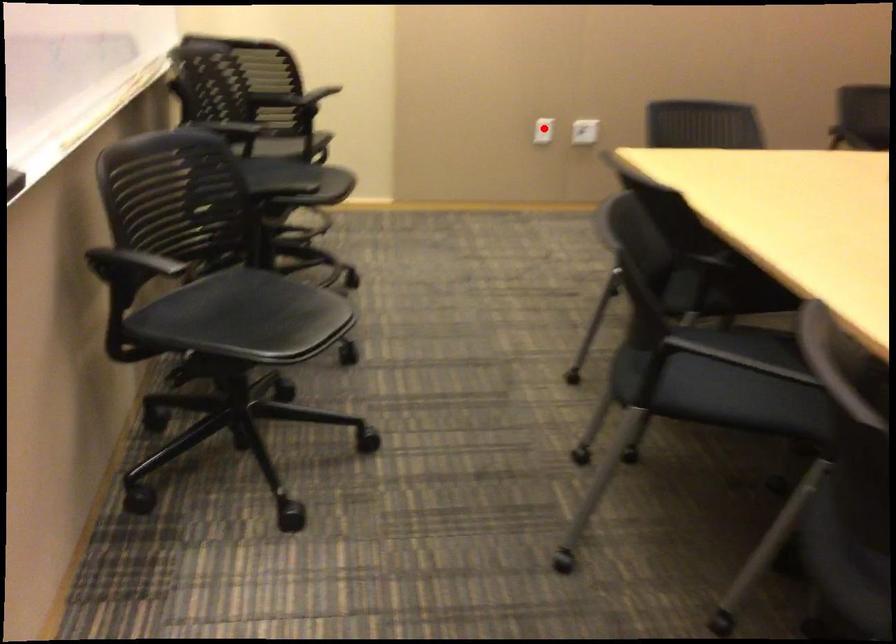
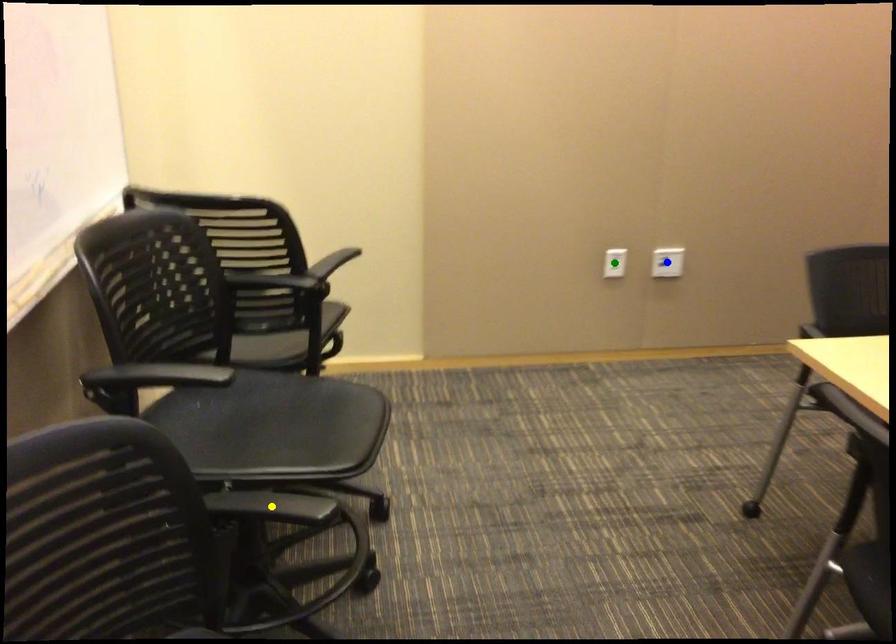
Question: I am providing you with two images of the same scene from different viewpoints. A red point is marked on the first image. You are given multiple points on the second image. In image 2, which mark is for the same physical point as the one in image 1?

Choices:
 (A) blue point
 (B) green point
 (C) yellow point

Answer: (B)